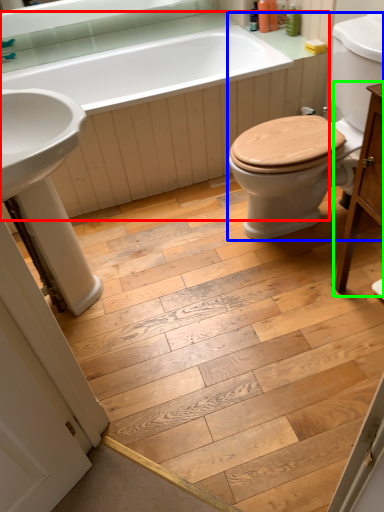
Question: Considering the real-world distances, which object is closest to bath (highlighted by a red box)? sit (highlighted by a blue box) or vanity (highlighted by a green box).

Choices:
 (A) sit
 (B) vanity

Answer: (A)